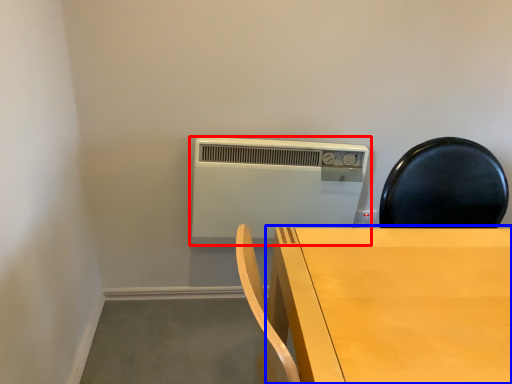
Question: Which object is further to the camera taking this photo, home appliance (highlighted by a red box) or table (highlighted by a blue box)?

Choices:
 (A) home appliance
 (B) table

Answer: (A)